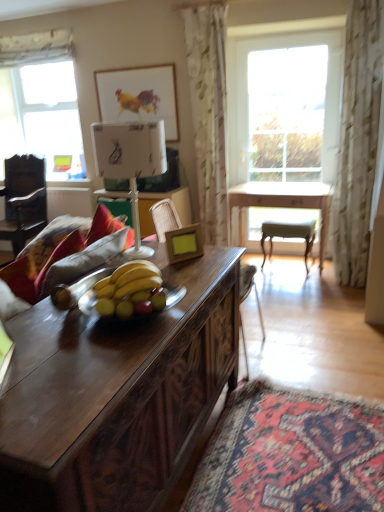
This screenshot has height=512, width=384. What do you see at coordinates (247, 83) in the screenshot?
I see `clear glass window at center, which is counted as the 2th window, starting from the back` at bounding box center [247, 83].

The height and width of the screenshot is (512, 384). What do you see at coordinates (184, 243) in the screenshot? I see `wooden picture frame at center, the 2th picture frame viewed from the back` at bounding box center [184, 243].

Image resolution: width=384 pixels, height=512 pixels. What do you see at coordinates (283, 203) in the screenshot? I see `light wood table at center` at bounding box center [283, 203].

What do you see at coordinates (130, 162) in the screenshot?
I see `white paper lampshade at center` at bounding box center [130, 162].

The width and height of the screenshot is (384, 512). What do you see at coordinates (164, 218) in the screenshot?
I see `wooden swivel chair at center` at bounding box center [164, 218].

The image size is (384, 512). Identify the location of clear glass window at center, which is counted as the 2th window, starting from the back. (247, 83).

Considering the positions of point (162, 86) and point (76, 102), is point (162, 86) closer or farther from the camera than point (76, 102)?

Point (162, 86) is closer to the camera than point (76, 102).

Considering the positions of objects watercolor paper picture frame at upper center, placed as the first picture frame when sorted from left to right, and clear glass window at upper left, which is the 1th window in back-to-front order, in the image provided, who is more to the left, watercolor paper picture frame at upper center, placed as the first picture frame when sorted from left to right, or clear glass window at upper left, which is the 1th window in back-to-front order,?

From the viewer's perspective, clear glass window at upper left, which is the 1th window in back-to-front order, appears more on the left side.

Considering the relative sizes of watercolor paper picture frame at upper center, marked as the 2th picture frame in a bottom-to-top arrangement, and clear glass window at upper left, acting as the 2th window starting from the right, in the image provided, is watercolor paper picture frame at upper center, marked as the 2th picture frame in a bottom-to-top arrangement, shorter than clear glass window at upper left, acting as the 2th window starting from the right,?

Yes.

Is watercolor paper picture frame at upper center, marked as the 2th picture frame in a bottom-to-top arrangement, aimed at clear glass window at upper left, acting as the 2th window starting from the right?

No, watercolor paper picture frame at upper center, marked as the 2th picture frame in a bottom-to-top arrangement, is not turned towards clear glass window at upper left, acting as the 2th window starting from the right.

Is clear glass window at upper left, which appears as the 1th window when viewed from the left, touching white paper lampshade at center?

No, clear glass window at upper left, which appears as the 1th window when viewed from the left, is not in contact with white paper lampshade at center.

Is clear glass window at upper left, which appears as the 1th window when viewed from the left, wider or thinner than white paper lampshade at center?

Considering their sizes, clear glass window at upper left, which appears as the 1th window when viewed from the left, looks slimmer than white paper lampshade at center.

In the image, is clear glass window at upper left, which is the 1th window in back-to-front order, on the left side or the right side of white paper lampshade at center?

From the image, it's evident that clear glass window at upper left, which is the 1th window in back-to-front order, is to the left of white paper lampshade at center.

From the image's perspective, relative to white paper lampshade at center, is clear glass window at upper left, which is the 1th window in back-to-front order, above or below?

Based on their image positions, clear glass window at upper left, which is the 1th window in back-to-front order, is located above white paper lampshade at center.

Is wooden picture frame at center, arranged as the first picture frame when viewed from the front, thinner than wooden swivel chair at center?

Yes.

Which object is further away from the camera, wooden picture frame at center, arranged as the first picture frame when viewed from the front, or wooden swivel chair at center?

wooden swivel chair at center is further away from the camera.

Can you see wooden picture frame at center, which appears as the first picture frame when ordered from the bottom, touching wooden swivel chair at center?

No, wooden picture frame at center, which appears as the first picture frame when ordered from the bottom, is not touching wooden swivel chair at center.

In terms of height, does wooden picture frame at center, which is the second picture frame from left to right, look taller or shorter compared to wooden swivel chair at center?

Clearly, wooden picture frame at center, which is the second picture frame from left to right, is shorter compared to wooden swivel chair at center.

Considering the sizes of clear glass window at center, marked as the first window in a right-to-left arrangement, and light wood table at center in the image, is clear glass window at center, marked as the first window in a right-to-left arrangement, wider or thinner than light wood table at center?

In the image, clear glass window at center, marked as the first window in a right-to-left arrangement, appears to be more narrow than light wood table at center.

Is clear glass window at center, the first window from the front, oriented away from light wood table at center?

Yes, clear glass window at center, the first window from the front, is facing away from light wood table at center.

Would you say clear glass window at center, marked as the first window in a right-to-left arrangement, is outside light wood table at center?

Indeed, clear glass window at center, marked as the first window in a right-to-left arrangement, is completely outside light wood table at center.

From a real-world perspective, is clear glass window at center, which is counted as the 2th window, starting from the back, located higher than light wood table at center?

Yes.

Would you say clear glass window at center, which is counted as the 2th window, starting from the back, is part of white floral fabric curtain at right, which is the first curtain in right-to-left order,'s contents?

No, clear glass window at center, which is counted as the 2th window, starting from the back, is not inside white floral fabric curtain at right, which is the first curtain in right-to-left order.

Could you tell me if white floral fabric curtain at right, which is counted as the 2th curtain, starting from the left, is turned towards clear glass window at center, which is the 2th window from left to right?

No, white floral fabric curtain at right, which is counted as the 2th curtain, starting from the left, does not turn towards clear glass window at center, which is the 2th window from left to right.

Considering the sizes of objects white floral fabric curtain at right, which is the first curtain in right-to-left order, and clear glass window at center, marked as the first window in a right-to-left arrangement, in the image provided, who is bigger, white floral fabric curtain at right, which is the first curtain in right-to-left order, or clear glass window at center, marked as the first window in a right-to-left arrangement,?

With larger size is clear glass window at center, marked as the first window in a right-to-left arrangement.

From the image's perspective, is white floral fabric curtain at right, which is counted as the 2th curtain, starting from the left, over clear glass window at upper left, positioned as the second window in front-to-back order?

Actually, white floral fabric curtain at right, which is counted as the 2th curtain, starting from the left, appears below clear glass window at upper left, positioned as the second window in front-to-back order, in the image.

Which object is closer to the camera taking this photo, white floral fabric curtain at right, which is the first curtain in right-to-left order, or clear glass window at upper left, acting as the 2th window starting from the right?

white floral fabric curtain at right, which is the first curtain in right-to-left order, is more forward.

This screenshot has height=512, width=384. What are the coordinates of `window that is the 2nd object to the left of the white floral fabric curtain at right, which is counted as the 2th curtain, starting from the left, starting at the anchor` in the screenshot? It's located at (42, 117).

How different are the orientations of white floral fabric curtain at right, which is counted as the 2th curtain, starting from the left, and clear glass window at upper left, positioned as the second window in front-to-back order, in degrees?

white floral fabric curtain at right, which is counted as the 2th curtain, starting from the left, and clear glass window at upper left, positioned as the second window in front-to-back order, are facing 1.68 degrees away from each other.

Measure the distance from light wood table at center to wooden swivel chair at center.

light wood table at center is 4.41 feet away from wooden swivel chair at center.

Who is smaller, light wood table at center or wooden swivel chair at center?

With smaller size is wooden swivel chair at center.

Considering the sizes of objects light wood table at center and wooden swivel chair at center in the image provided, who is thinner, light wood table at center or wooden swivel chair at center?

light wood table at center.

Find the location of a particular element. This screenshot has height=512, width=384. swivel chair that is in front of the light wood table at center is located at coordinates (164, 218).

Where is `window lying behind the watercolor paper picture frame at upper center, the first picture frame in the top-to-bottom sequence`? window lying behind the watercolor paper picture frame at upper center, the first picture frame in the top-to-bottom sequence is located at coordinates (42, 117).

You are a GUI agent. You are given a task and a screenshot of the screen. Output one action in this format:
    pyautogui.click(x=<x>, y=<y>)
    Task: Click on the window that is the 2nd object located above the white paper lampshade at center (from the image's perspective)
    This screenshot has height=512, width=384.
    Given the screenshot: What is the action you would take?
    pyautogui.click(x=42, y=117)

Looking at the image, which one is located closer to wooden swivel chair at center, white floral fabric curtain at right, which is counted as the 2th curtain, starting from the left, or wooden picture frame at center, which appears as the 2th picture frame when viewed from the top?

Among the two, wooden picture frame at center, which appears as the 2th picture frame when viewed from the top, is located nearer to wooden swivel chair at center.

From the image, which object appears to be nearer to clear glass window at upper left, which is the 1th window in back-to-front order, clear glass window at center, which is counted as the 2th window, starting from the back, or light wood table at center?

clear glass window at center, which is counted as the 2th window, starting from the back, lies closer to clear glass window at upper left, which is the 1th window in back-to-front order, than the other object.

Considering their positions, is watercolor paper picture frame at upper center, marked as the 2th picture frame in a bottom-to-top arrangement, positioned further to clear glass window at upper left, positioned as the second window in front-to-back order, than clear glass window at center, which is counted as the 2th window, starting from the back?

The object further to clear glass window at upper left, positioned as the second window in front-to-back order, is clear glass window at center, which is counted as the 2th window, starting from the back.

Looking at the image, which one is located closer to white floral fabric curtain at upper center, acting as the second curtain starting from the right, dark wood desk at center or white floral fabric curtain at right, which is counted as the 2th curtain, starting from the left?

Based on the image, white floral fabric curtain at right, which is counted as the 2th curtain, starting from the left, appears to be nearer to white floral fabric curtain at upper center, acting as the second curtain starting from the right.

Based on their spatial positions, is dark wood desk at center or white paper lampshade at center closer to clear glass window at center, the first window from the front?

white paper lampshade at center lies closer to clear glass window at center, the first window from the front, than the other object.

Considering their positions, is white floral fabric curtain at right, which is the first curtain in right-to-left order, positioned closer to clear glass window at center, marked as the first window in a right-to-left arrangement, than wooden swivel chair at center?

Among the two, white floral fabric curtain at right, which is the first curtain in right-to-left order, is located nearer to clear glass window at center, marked as the first window in a right-to-left arrangement.

When comparing their distances from dark wood desk at center, does wooden swivel chair at center or watercolor paper picture frame at upper center, the second picture frame positioned from the front, seem closer?

wooden swivel chair at center lies closer to dark wood desk at center than the other object.

When comparing their distances from clear glass window at upper left, acting as the 2th window starting from the right, does light wood table at center or dark wood desk at center seem closer?

The object closer to clear glass window at upper left, acting as the 2th window starting from the right, is light wood table at center.

You are a GUI agent. You are given a task and a screenshot of the screen. Output one action in this format:
    pyautogui.click(x=<x>, y=<y>)
    Task: Click on the curtain between watercolor paper picture frame at upper center, marked as the 1th picture frame in a back-to-front arrangement, and green fabric chair at center
    The width and height of the screenshot is (384, 512).
    Given the screenshot: What is the action you would take?
    pyautogui.click(x=209, y=114)

Where is `curtain between clear glass window at upper left, acting as the 2th window starting from the right, and clear glass window at center, which is the 2th window from left to right, in the horizontal direction`? curtain between clear glass window at upper left, acting as the 2th window starting from the right, and clear glass window at center, which is the 2th window from left to right, in the horizontal direction is located at coordinates (209, 114).

This screenshot has width=384, height=512. In order to click on table positioned between white floral fabric curtain at right, which is the first curtain in right-to-left order, and green fabric chair at center from near to far in this screenshot , I will do `click(283, 203)`.

Locate an element on the screen. window between white floral fabric curtain at upper center, acting as the second curtain starting from the right, and white floral fabric curtain at right, which is the first curtain in right-to-left order, in the horizontal direction is located at coordinates (247, 83).